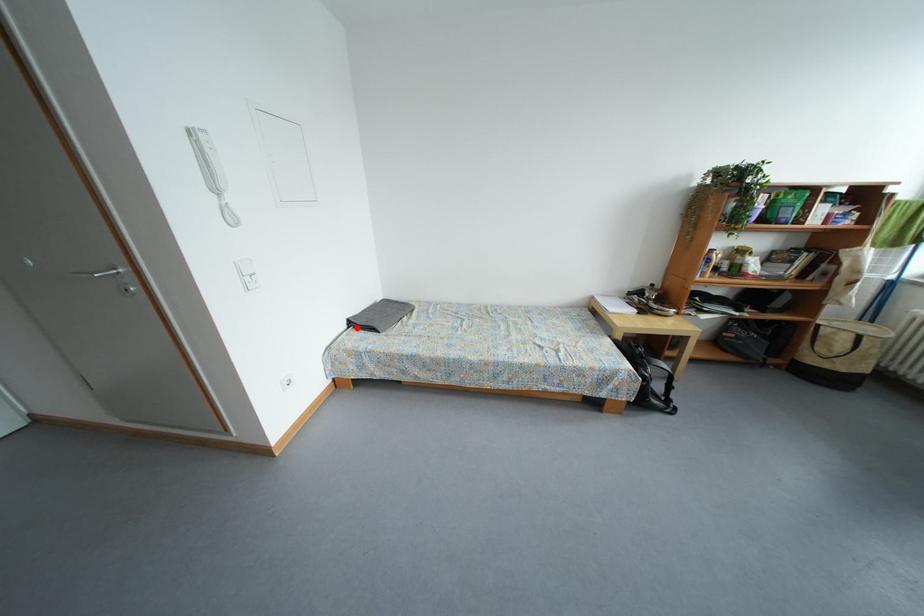
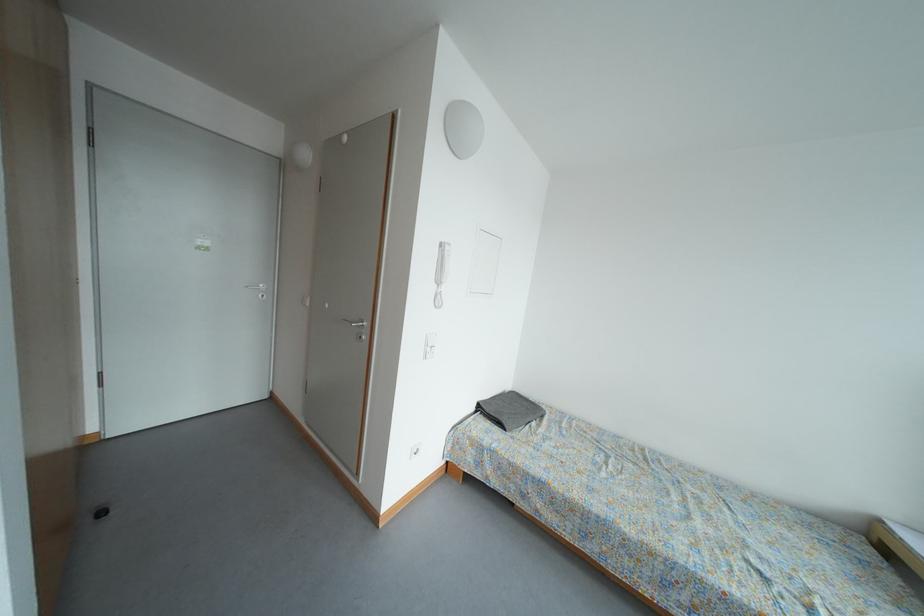
Where in the second image is the point corresponding to the highlighted location from the first image?

(485, 411)